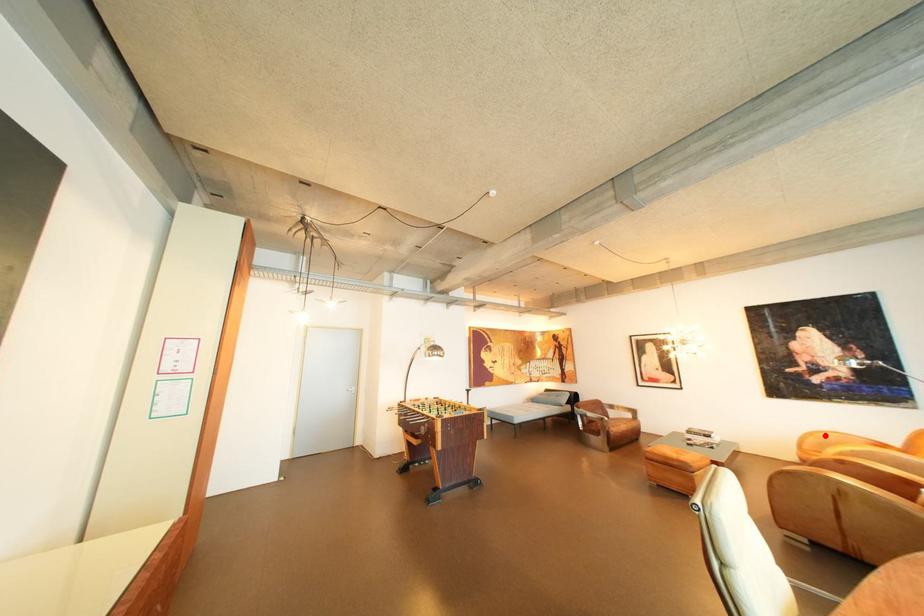
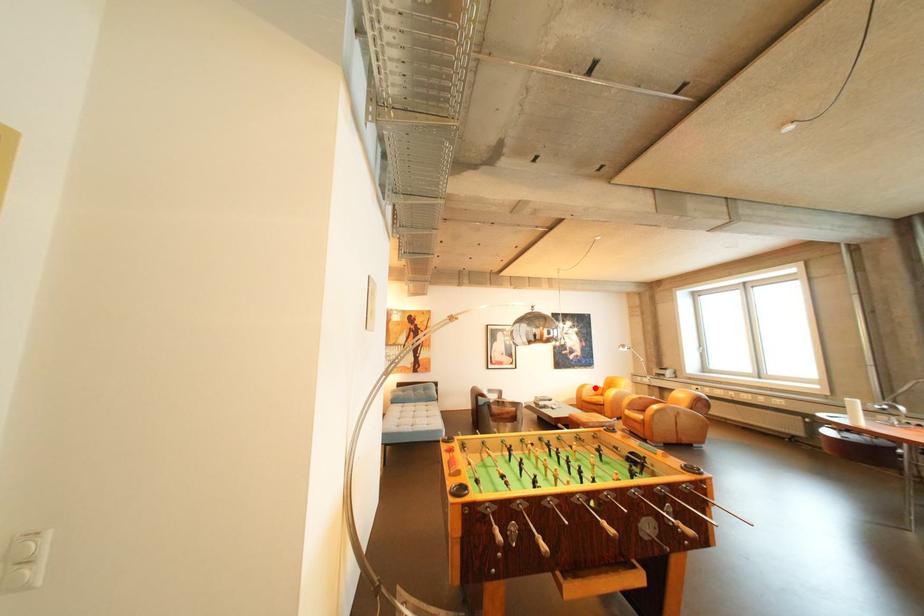
I am providing you with two images of the same scene from different viewpoints. A red point is marked on the first image and another point is marked on the second image. Do the highlighted points in image1 and image2 indicate the same real-world spot?

Yes